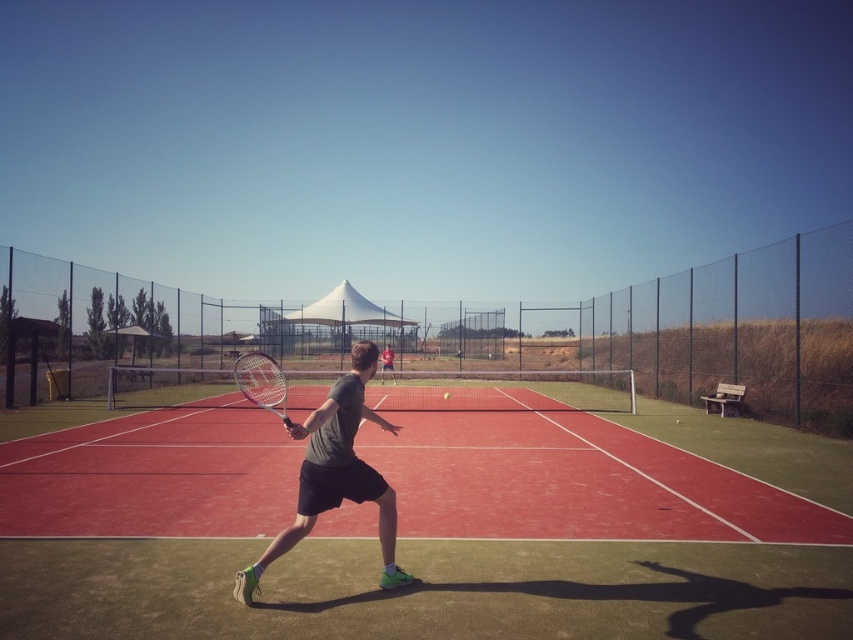
Question: Estimate the real-world distances between objects in this image. Which object is farther from the gray matte tennis racket at center?

Choices:
 (A) matte gray shirt at center
 (B) yellow rubber tennis ball at center
 (C) matte black tennis racket at center

Answer: (A)

Question: Which object is positioned farthest from the red rubber tennis court at center?

Choices:
 (A) yellow rubber tennis ball at center
 (B) gray matte tennis racket at center
 (C) matte black tennis racket at center
 (D) matte gray shirt at center

Answer: (D)

Question: Where is matte black tennis racket at center located in relation to yellow rubber tennis ball at center in the image?

Choices:
 (A) left
 (B) right

Answer: (A)

Question: Is red rubber tennis court at center to the right of matte gray shirt at center from the viewer's perspective?

Choices:
 (A) no
 (B) yes

Answer: (B)

Question: Which point is farther from the camera taking this photo?

Choices:
 (A) (448, 611)
 (B) (254, 394)
 (C) (384, 365)
 (D) (445, 392)

Answer: (C)

Question: Is red rubber tennis court at center wider than matte gray shirt at center?

Choices:
 (A) yes
 (B) no

Answer: (A)